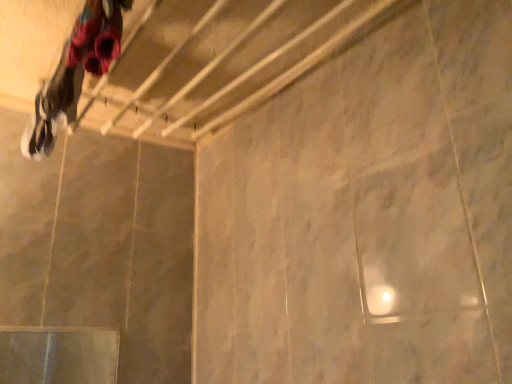
Question: Should I look upward or downward to see white leather sneakers at upper left?

Choices:
 (A) up
 (B) down

Answer: (A)